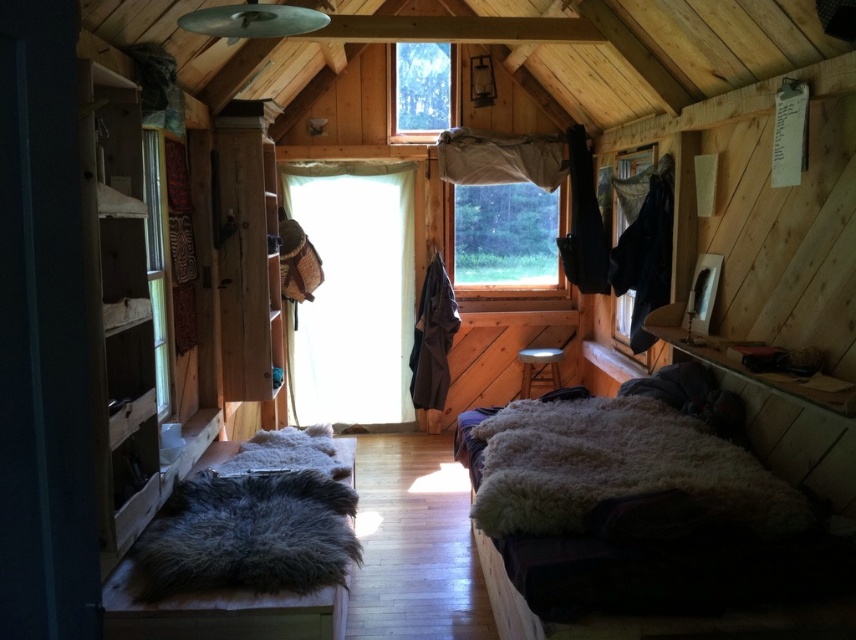
Question: Which object is the closest to the transparent fabric at right?

Choices:
 (A) clear glass window at left
 (B) transparent glass window at upper center

Answer: (B)

Question: Is transparent fabric at center above transparent fabric at right?

Choices:
 (A) yes
 (B) no

Answer: (B)

Question: Estimate the real-world distances between objects in this image. Which object is closer to the transparent fabric at center?

Choices:
 (A) transparent glass window at upper center
 (B) transparent fabric at right

Answer: (A)

Question: In this image, where is transparent fabric at center located relative to transparent glass window at upper center?

Choices:
 (A) right
 (B) left

Answer: (A)

Question: Where is fuzzy woolen blanket at lower center located in relation to clear glass window at left in the image?

Choices:
 (A) right
 (B) left

Answer: (A)

Question: Among these points, which one is farthest from the camera?

Choices:
 (A) (482, 173)
 (B) (390, 125)

Answer: (B)